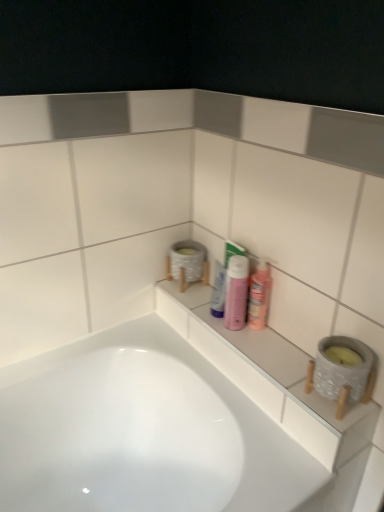
Question: Is white glossy tube at center, marked as the second mouthwash in a right-to-left arrangement, oriented away from pink matte bottle at center?

Choices:
 (A) no
 (B) yes

Answer: (A)

Question: Would you say white glossy tube at center, marked as the second mouthwash in a right-to-left arrangement, is outside pink matte bottle at center?

Choices:
 (A) no
 (B) yes

Answer: (B)

Question: From the image's perspective, is white glossy tube at center, marked as the second mouthwash in a right-to-left arrangement, over pink matte bottle at center?

Choices:
 (A) yes
 (B) no

Answer: (A)

Question: Does white glossy tube at center, the 1th mouthwash from the left, appear on the right side of pink matte bottle at center?

Choices:
 (A) yes
 (B) no

Answer: (B)

Question: Can you confirm if white glossy tube at center, marked as the second mouthwash in a right-to-left arrangement, is wider than pink matte bottle at center?

Choices:
 (A) yes
 (B) no

Answer: (B)

Question: From a real-world perspective, is white glossy tube at center, the 1th mouthwash from the left, under pink matte bottle at center?

Choices:
 (A) no
 (B) yes

Answer: (B)

Question: From a real-world perspective, is white ceramic ledge at center on top of pink glossy mouthwash at center, arranged as the first mouthwash when viewed from the right?

Choices:
 (A) no
 (B) yes

Answer: (A)

Question: Does white ceramic ledge at center have a larger size compared to pink glossy mouthwash at center, which is the second mouthwash in left-to-right order?

Choices:
 (A) no
 (B) yes

Answer: (B)

Question: Is white ceramic ledge at center not inside pink glossy mouthwash at center, which is the second mouthwash in left-to-right order?

Choices:
 (A) yes
 (B) no

Answer: (A)

Question: Does white ceramic ledge at center have a smaller size compared to pink glossy mouthwash at center, arranged as the first mouthwash when viewed from the right?

Choices:
 (A) yes
 (B) no

Answer: (B)

Question: Does white ceramic ledge at center have a greater width compared to pink glossy mouthwash at center, arranged as the first mouthwash when viewed from the right?

Choices:
 (A) no
 (B) yes

Answer: (B)

Question: Is pink glossy mouthwash at center, which is the second mouthwash in left-to-right order, at the back of white ceramic ledge at center?

Choices:
 (A) no
 (B) yes

Answer: (A)

Question: Considering the relative sizes of pink glossy mouthwash at center, which is the second mouthwash in left-to-right order, and pink matte bottle at center in the image provided, is pink glossy mouthwash at center, which is the second mouthwash in left-to-right order, smaller than pink matte bottle at center?

Choices:
 (A) no
 (B) yes

Answer: (B)